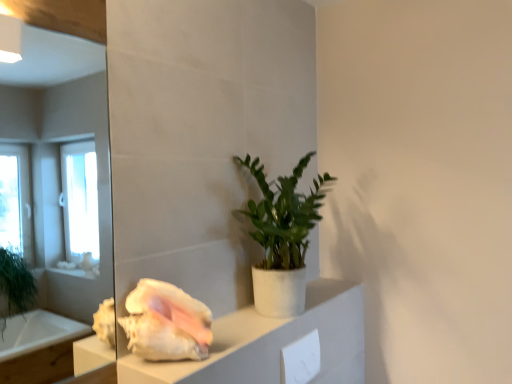
This screenshot has height=384, width=512. What are the coordinates of `green matte plant at center` in the screenshot? It's located at (282, 236).

The height and width of the screenshot is (384, 512). Identify the location of white glossy seashell at lower left. (166, 323).

This screenshot has width=512, height=384. Find the location of `green matte plant at center`. green matte plant at center is located at coordinates (282, 236).

From the image's perspective, does white matte cabinet at center appear lower than white glossy seashell at lower left?

Correct, white matte cabinet at center appears lower than white glossy seashell at lower left in the image.

From a real-world perspective, who is located lower, white matte cabinet at center or white glossy seashell at lower left?

From a 3D spatial view, white matte cabinet at center is below.

Looking at this image, is white matte cabinet at center not close to white glossy seashell at lower left?

No, white matte cabinet at center is not far from white glossy seashell at lower left.

Is white matte cabinet at center situated inside white glossy seashell at lower left or outside?

white matte cabinet at center is located beyond the bounds of white glossy seashell at lower left.

Consider the image. Between white glossy seashell at lower left and green matte plant at center, which one is positioned in front?

Positioned in front is white glossy seashell at lower left.

Considering the positions of point (205, 310) and point (279, 254), is point (205, 310) closer or farther from the camera than point (279, 254)?

Clearly, point (205, 310) is closer to the camera than point (279, 254).

Is white glossy seashell at lower left aimed at green matte plant at center?

No, white glossy seashell at lower left is not facing towards green matte plant at center.

You are a GUI agent. You are given a task and a screenshot of the screen. Output one action in this format:
    pyautogui.click(x=<x>, y=<y>)
    Task: Click on the houseplant on the right of white glossy seashell at lower left
    The width and height of the screenshot is (512, 384).
    Given the screenshot: What is the action you would take?
    pyautogui.click(x=282, y=236)

Is green matte plant at center turned away from white glossy seashell at lower left?

No.

Does green matte plant at center have a smaller size compared to white glossy seashell at lower left?

No, green matte plant at center is not smaller than white glossy seashell at lower left.

From the image's perspective, is green matte plant at center on white glossy seashell at lower left?

Yes.

Measure the distance from white matte cabinet at center to green matte plant at center.

A distance of 12.00 inches exists between white matte cabinet at center and green matte plant at center.

Between point (124, 361) and point (293, 292), which one is positioned behind?

Point (293, 292)

Consider the image. Visually, is white matte cabinet at center positioned to the left or to the right of green matte plant at center?

white matte cabinet at center is to the left of green matte plant at center.

From a real-world perspective, which object stands above the other?

green matte plant at center is physically above.

What's the angular difference between green matte plant at center and white matte cabinet at center's facing directions?

The angle between the facing direction of green matte plant at center and the facing direction of white matte cabinet at center is 0.891 degrees.

Is green matte plant at center to the left of white matte cabinet at center from the viewer's perspective?

Incorrect, green matte plant at center is not on the left side of white matte cabinet at center.

Which point is more distant from viewer, (307, 235) or (263, 347)?

Positioned behind is point (307, 235).

Is white matte cabinet at center completely or partially inside white glossy seashell at lower left?

No, white matte cabinet at center is not surrounded by white glossy seashell at lower left.

Can you tell me how much white glossy seashell at lower left and white matte cabinet at center differ in facing direction?

0.161 degrees.

From the image's perspective, who appears lower, white glossy seashell at lower left or white matte cabinet at center?

white matte cabinet at center, from the image's perspective.

From a real-world perspective, which is physically above, white glossy seashell at lower left or white matte cabinet at center?

white glossy seashell at lower left, from a real-world perspective.

Find the location of a particular element. The height and width of the screenshot is (384, 512). cabinetry directly beneath the white glossy seashell at lower left (from a real-world perspective) is located at coordinates (271, 343).

Locate an element on the screen. Image resolution: width=512 pixels, height=384 pixels. houseplant on the right of white glossy seashell at lower left is located at coordinates (282, 236).

Which object lies nearer to the anchor point white glossy seashell at lower left, white matte cabinet at center or green matte plant at center?

The object closer to white glossy seashell at lower left is white matte cabinet at center.

Which object lies further to the anchor point green matte plant at center, white matte cabinet at center or white glossy seashell at lower left?

white glossy seashell at lower left lies further to green matte plant at center than the other object.

Which object lies further to the anchor point white glossy seashell at lower left, green matte plant at center or white matte cabinet at center?

green matte plant at center is positioned further to the anchor white glossy seashell at lower left.

When comparing their distances from white matte cabinet at center, does green matte plant at center or white glossy seashell at lower left seem further?

green matte plant at center is further to white matte cabinet at center.

Based on their spatial positions, is white glossy seashell at lower left or green matte plant at center closer to white matte cabinet at center?

Based on the image, white glossy seashell at lower left appears to be nearer to white matte cabinet at center.

Looking at the image, which one is located further to green matte plant at center, white glossy seashell at lower left or white matte cabinet at center?

white glossy seashell at lower left lies further to green matte plant at center than the other object.

You are a GUI agent. You are given a task and a screenshot of the screen. Output one action in this format:
    pyautogui.click(x=<x>, y=<y>)
    Task: Click on the cabinetry between white glossy seashell at lower left and green matte plant at center in the horizontal direction
    This screenshot has width=512, height=384.
    Given the screenshot: What is the action you would take?
    pyautogui.click(x=271, y=343)